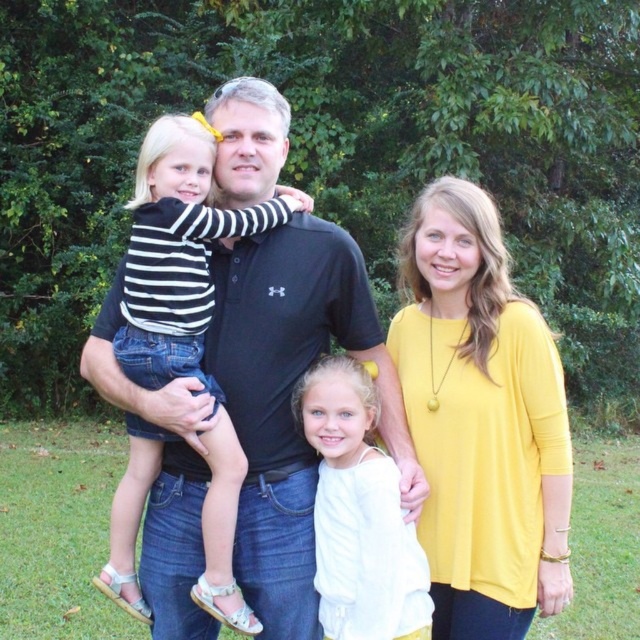
You are a photographer setting up for a family portrait. You notice the yellow matte top at center and the white cotton shirt at center in the scene. Which clothing item should you adjust to ensure both are visible in the frame?

The yellow matte top at center is taller than the white cotton shirt at center, so you should lower the camera angle to include the top of the yellow matte top while keeping the white cotton shirt visible.

Where is the yellow matte top at center located in the image?

The yellow matte top at center is located at point 0.658 on the horizontal axis and 0.753 on the vertical axis.